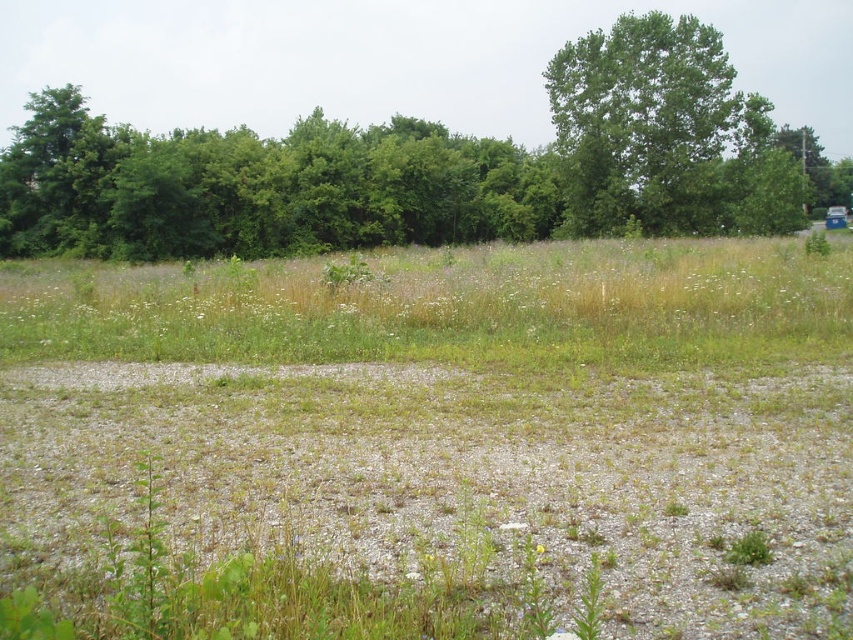
Is green grass at center positioned before yellow matte flower at center?

That is False.

Does green grass at center have a lesser height compared to yellow matte flower at center?

No, green grass at center is not shorter than yellow matte flower at center.

What do you see at coordinates (466, 291) in the screenshot? I see `green grass at center` at bounding box center [466, 291].

In order to click on green grass at center in this screenshot , I will do `click(466, 291)`.

Does point (828, 582) come farther from viewer compared to point (537, 273)?

That is False.

Can you confirm if gray gravel at center is positioned to the left of green grass at center?

Incorrect, gray gravel at center is not on the left side of green grass at center.

Is point (648, 536) farther from camera compared to point (148, 324)?

No.

Locate an element on the screen. gray gravel at center is located at coordinates (463, 477).

This screenshot has width=853, height=640. What do you see at coordinates (431, 166) in the screenshot?
I see `green leafy tree at upper center` at bounding box center [431, 166].

Who is positioned more to the right, green leafy tree at upper center or green grass at center?

green grass at center is more to the right.

Between point (550, 68) and point (843, 244), which one is positioned behind?

Positioned behind is point (550, 68).

The height and width of the screenshot is (640, 853). I want to click on green leafy tree at upper center, so click(x=431, y=166).